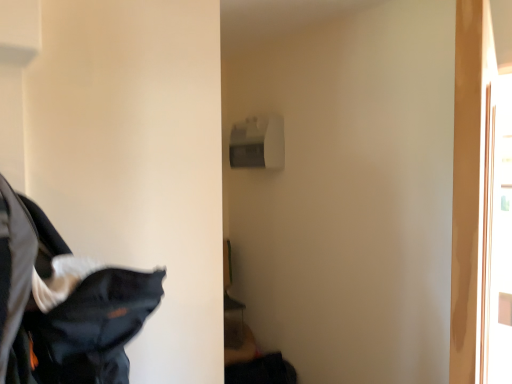
I want to click on transparent glass screen door at right, so click(x=500, y=235).

Describe the element at coordinates (500, 235) in the screenshot. I see `transparent glass screen door at right` at that location.

What do you see at coordinates (63, 304) in the screenshot?
I see `dark blue fabric at lower left` at bounding box center [63, 304].

The image size is (512, 384). I want to click on dark blue fabric at lower left, so click(x=63, y=304).

This screenshot has height=384, width=512. I want to click on transparent glass screen door at right, so click(x=500, y=235).

Which is more to the left, dark blue fabric at lower left or transparent glass screen door at right?

Positioned to the left is dark blue fabric at lower left.

Is dark blue fabric at lower left in front of or behind transparent glass screen door at right in the image?

dark blue fabric at lower left is positioned closer to the viewer than transparent glass screen door at right.

Is point (4, 243) farther from viewer compared to point (500, 138)?

No, (4, 243) is closer to viewer.

From the image's perspective, is dark blue fabric at lower left located above transparent glass screen door at right?

Incorrect, from the image's perspective, dark blue fabric at lower left is lower than transparent glass screen door at right.

From a real-world perspective, is dark blue fabric at lower left positioned above or below transparent glass screen door at right?

From a real-world perspective, dark blue fabric at lower left is physically below transparent glass screen door at right.

Considering the sizes of objects dark blue fabric at lower left and transparent glass screen door at right in the image provided, who is thinner, dark blue fabric at lower left or transparent glass screen door at right?

transparent glass screen door at right is thinner.

Based on the photo, considering the sizes of dark blue fabric at lower left and transparent glass screen door at right in the image, is dark blue fabric at lower left taller or shorter than transparent glass screen door at right?

Clearly, dark blue fabric at lower left is shorter compared to transparent glass screen door at right.

Can you confirm if dark blue fabric at lower left is smaller than transparent glass screen door at right?

Actually, dark blue fabric at lower left might be larger than transparent glass screen door at right.

Is dark blue fabric at lower left inside the boundaries of transparent glass screen door at right, or outside?

dark blue fabric at lower left is outside transparent glass screen door at right.

Is dark blue fabric at lower left touching transparent glass screen door at right?

No, dark blue fabric at lower left is not beside transparent glass screen door at right.

Is dark blue fabric at lower left facing away from transparent glass screen door at right?

No.

How many degrees apart are the facing directions of dark blue fabric at lower left and transparent glass screen door at right?

The angular difference between dark blue fabric at lower left and transparent glass screen door at right is 88.5 degrees.

Locate an element on the screen. This screenshot has height=384, width=512. laundry directly beneath the transparent glass screen door at right (from a real-world perspective) is located at coordinates (63, 304).

Considering the positions of objects transparent glass screen door at right and dark blue fabric at lower left in the image provided, who is more to the right, transparent glass screen door at right or dark blue fabric at lower left?

transparent glass screen door at right.

Considering the relative positions of transparent glass screen door at right and dark blue fabric at lower left in the image provided, is transparent glass screen door at right behind dark blue fabric at lower left?

That is True.

Is point (501, 89) farther from camera compared to point (54, 231)?

Yes, point (501, 89) is behind point (54, 231).

From the image's perspective, between transparent glass screen door at right and dark blue fabric at lower left, who is located below?

From the image's view, dark blue fabric at lower left is below.

From a real-world perspective, is transparent glass screen door at right physically located above or below dark blue fabric at lower left?

In terms of real-world spatial position, transparent glass screen door at right is above dark blue fabric at lower left.

Can you confirm if transparent glass screen door at right is thinner than dark blue fabric at lower left?

Yes.

Is transparent glass screen door at right taller or shorter than dark blue fabric at lower left?

In the image, transparent glass screen door at right appears to be taller than dark blue fabric at lower left.

Which of these two, transparent glass screen door at right or dark blue fabric at lower left, is smaller?

With smaller size is transparent glass screen door at right.

Is transparent glass screen door at right not within dark blue fabric at lower left?

Indeed, transparent glass screen door at right is completely outside dark blue fabric at lower left.

Is transparent glass screen door at right far away from dark blue fabric at lower left?

Yes.

Is transparent glass screen door at right oriented towards dark blue fabric at lower left?

No, transparent glass screen door at right is not facing towards dark blue fabric at lower left.

How different are the orientations of transparent glass screen door at right and dark blue fabric at lower left in degrees?

There is a 88.5-degree angle between the facing directions of transparent glass screen door at right and dark blue fabric at lower left.

Measure the distance from transparent glass screen door at right to dark blue fabric at lower left.

transparent glass screen door at right is 4.09 feet away from dark blue fabric at lower left.

Where is `screen door on the right side of dark blue fabric at lower left`? This screenshot has width=512, height=384. screen door on the right side of dark blue fabric at lower left is located at coordinates (500, 235).

At what (x,y) coordinates should I click in order to perform the action: click on laundry below the transparent glass screen door at right (from a real-world perspective). Please return your answer as a coordinate pair (x, y). The height and width of the screenshot is (384, 512). Looking at the image, I should click on (63, 304).

Locate an element on the screen. This screenshot has width=512, height=384. laundry on the left of transparent glass screen door at right is located at coordinates (63, 304).